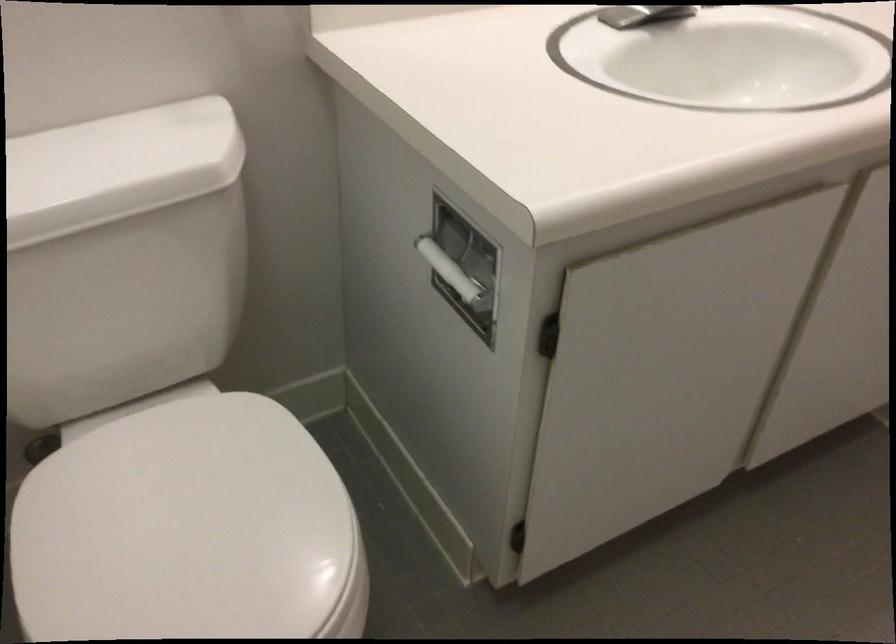
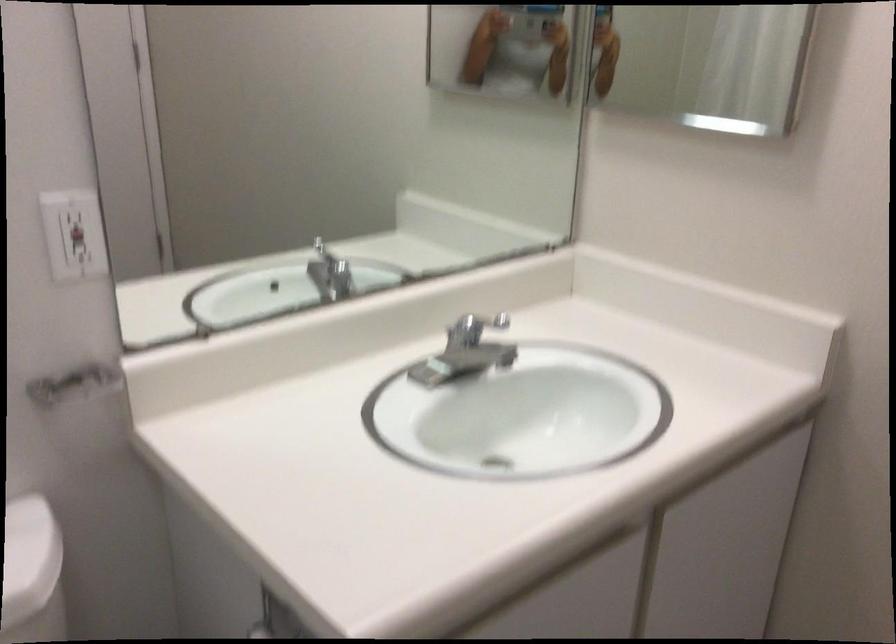
In a continuous first-person perspective shot, in which direction is the camera moving?

The movement direction of the cameraman is right, backward.